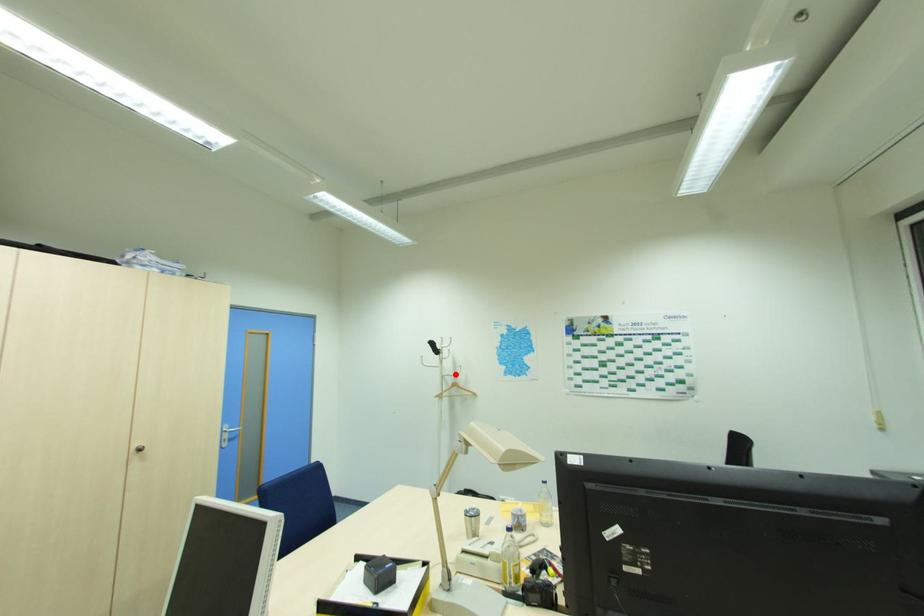
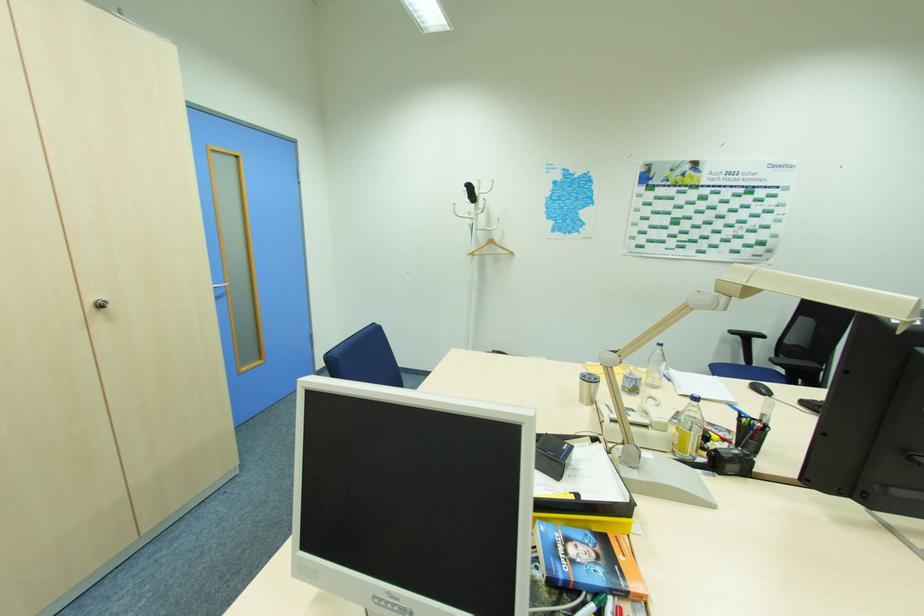
Find the pixel in the second image that matches the highlighted location in the first image.

(492, 229)